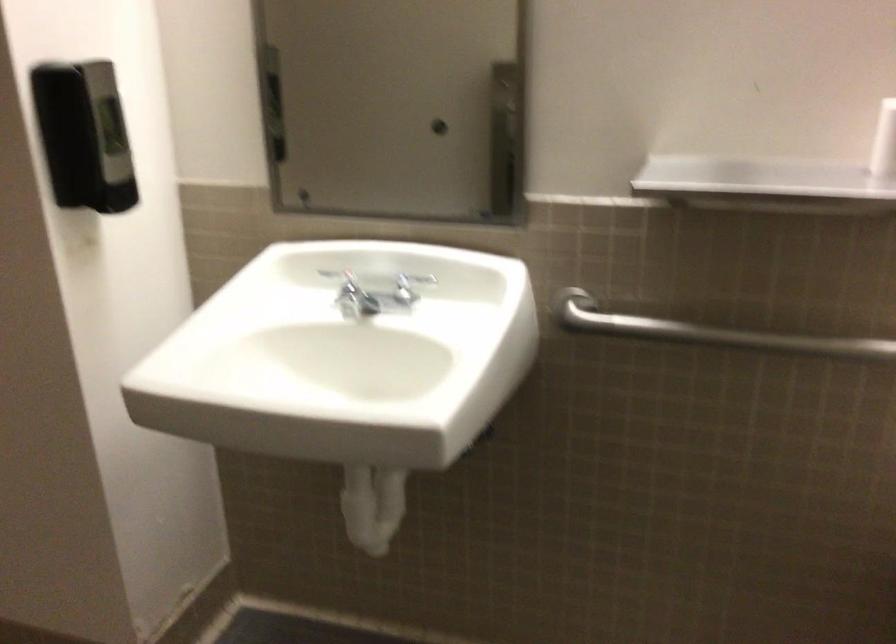
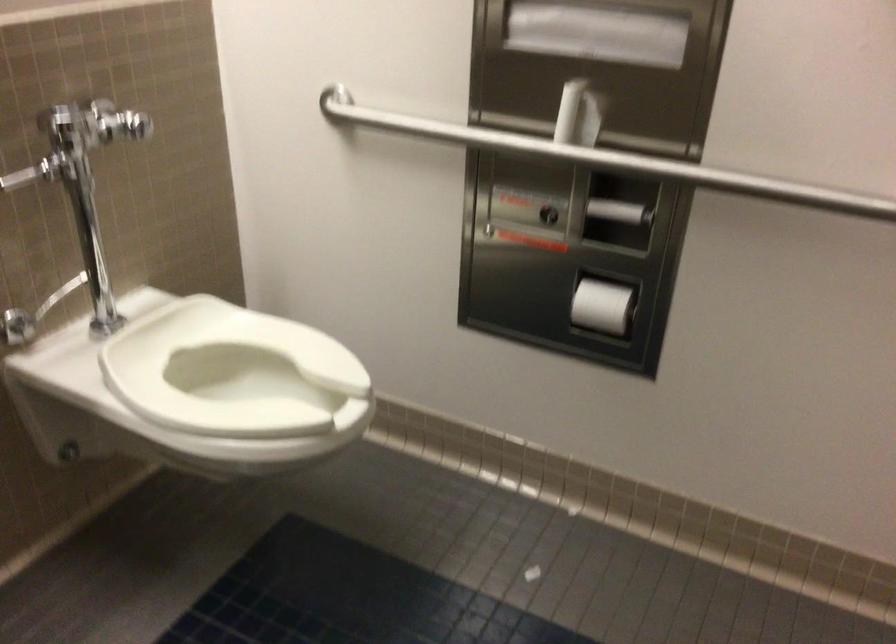
Based on the continuous images, in which direction is the camera rotating?

The camera rotated toward right-down.